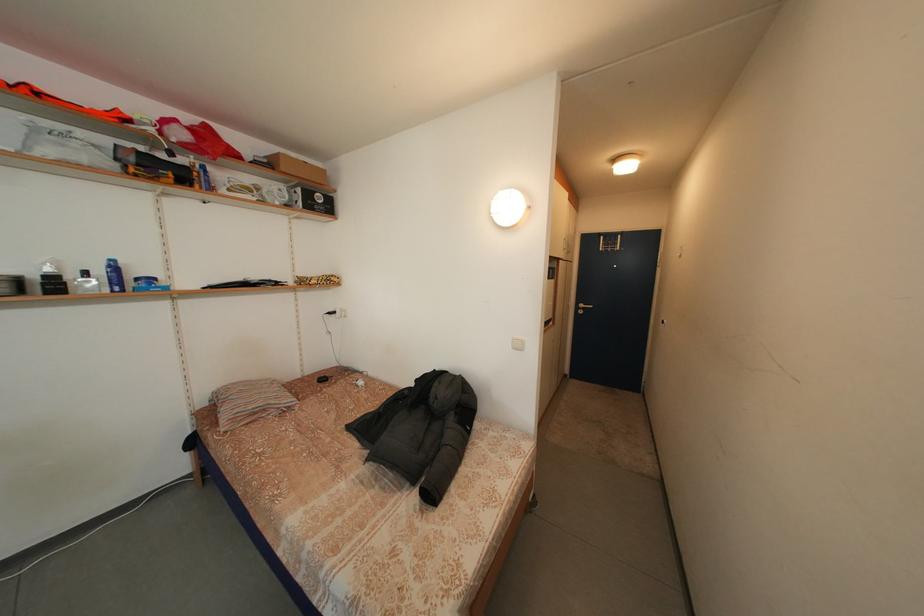
At what (x,y) coordinates should I click in order to perform the action: click on white light switch. Please return your answer as a coordinate pair (x, y). The image size is (924, 616). Looking at the image, I should click on (517, 344).